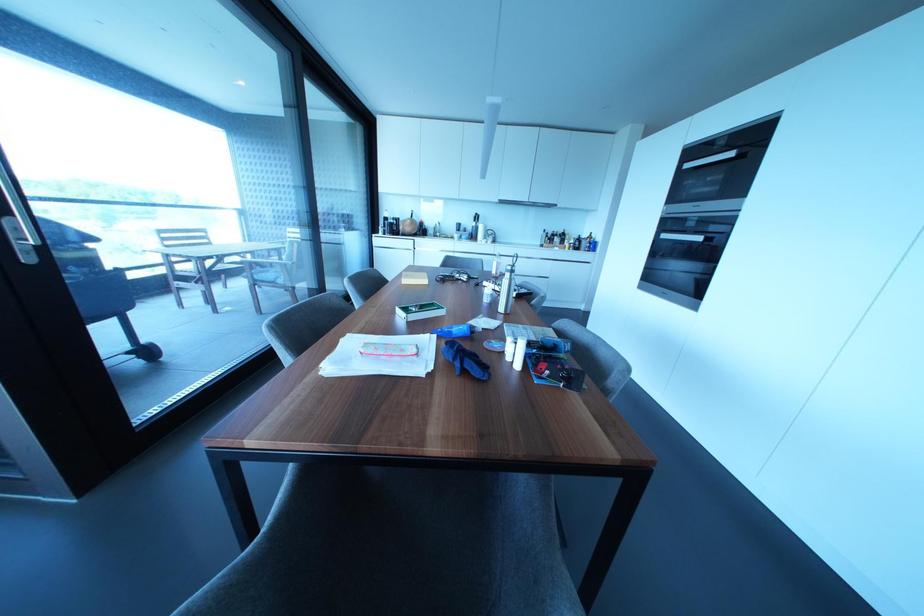
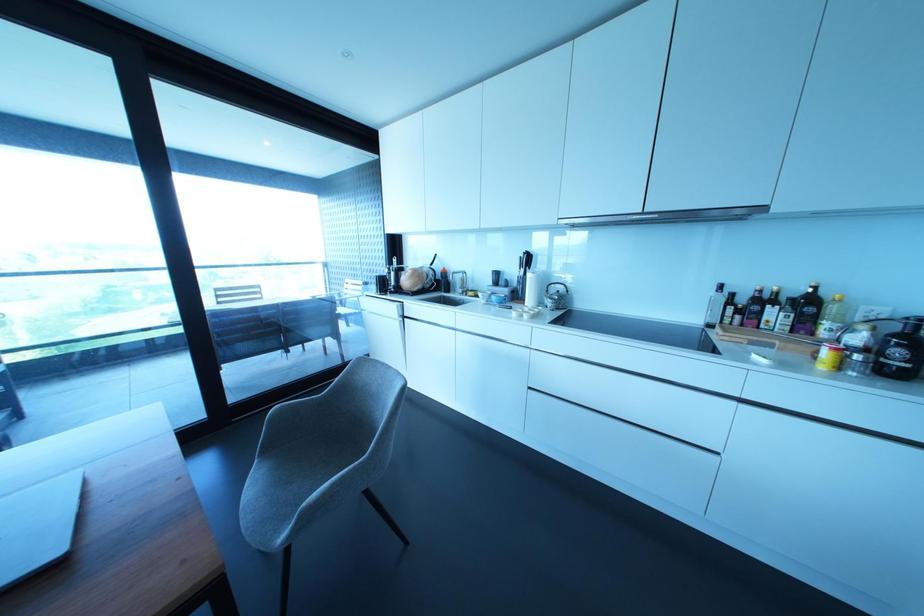
The point at (490, 238) is marked in the first image. Where is the corresponding point in the second image?

(549, 302)